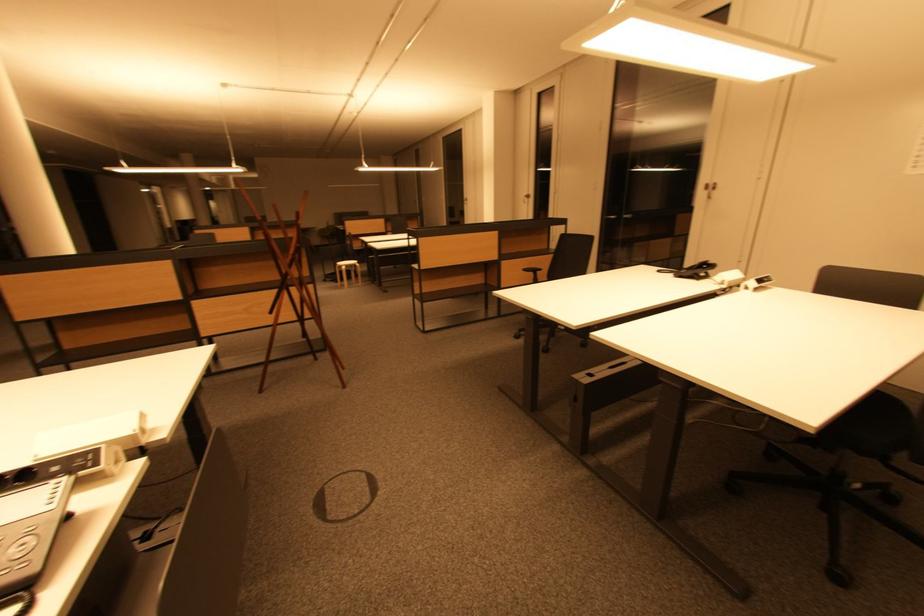
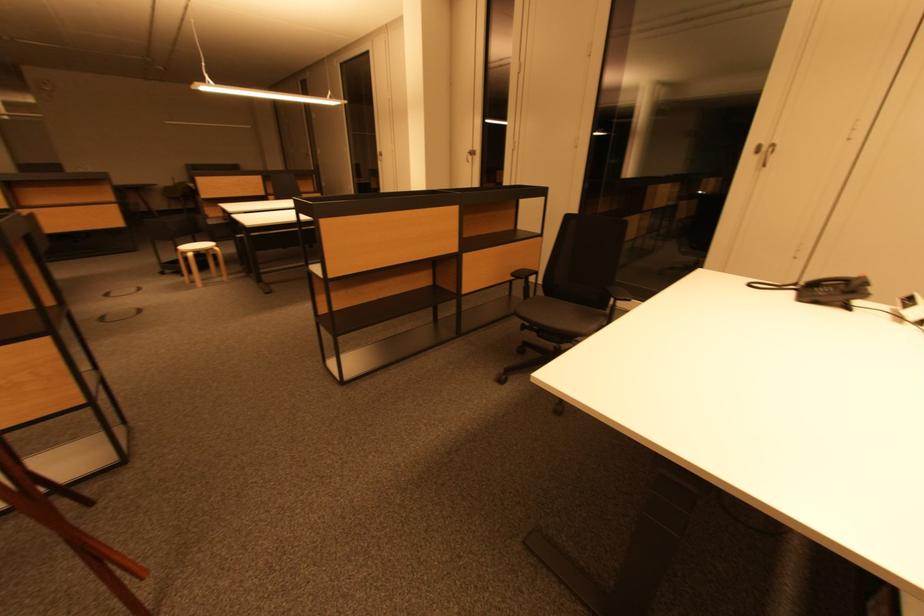
Locate, in the second image, the point that corresponds to [723,283] in the first image.

(918, 320)